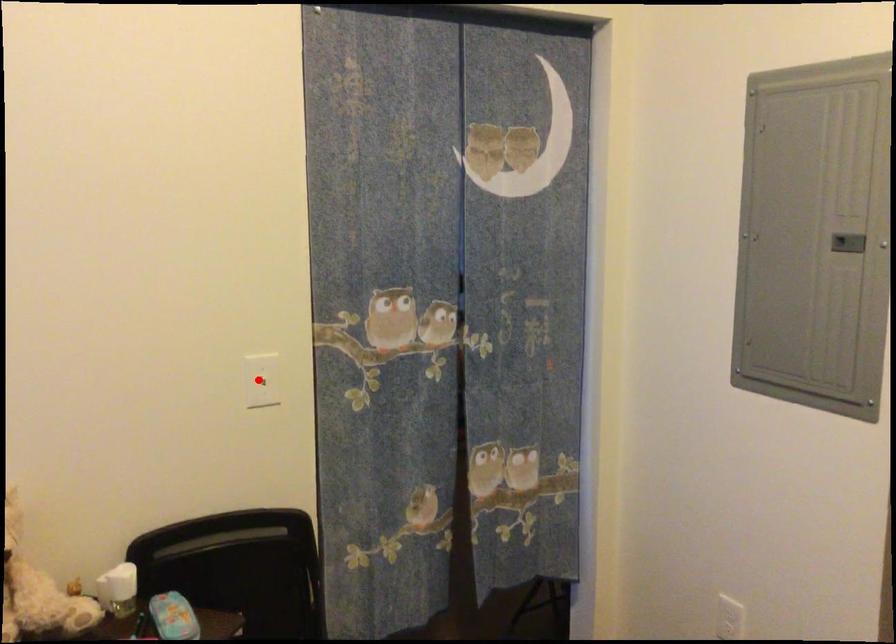
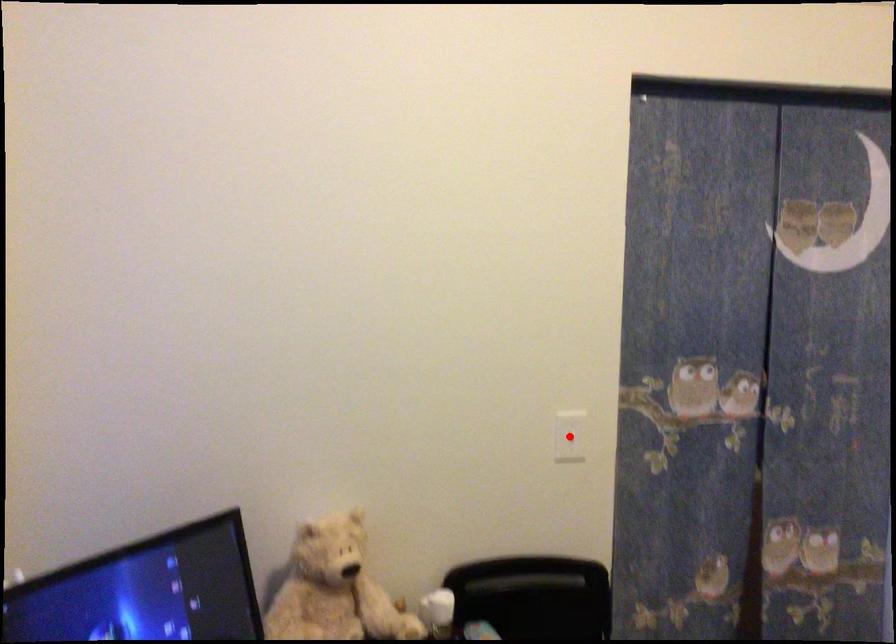
I am providing you with two images of the same scene from different viewpoints. A red point is marked on the first image and another point is marked on the second image. Is the marked point in image1 the same physical position as the marked point in image2?

Yes